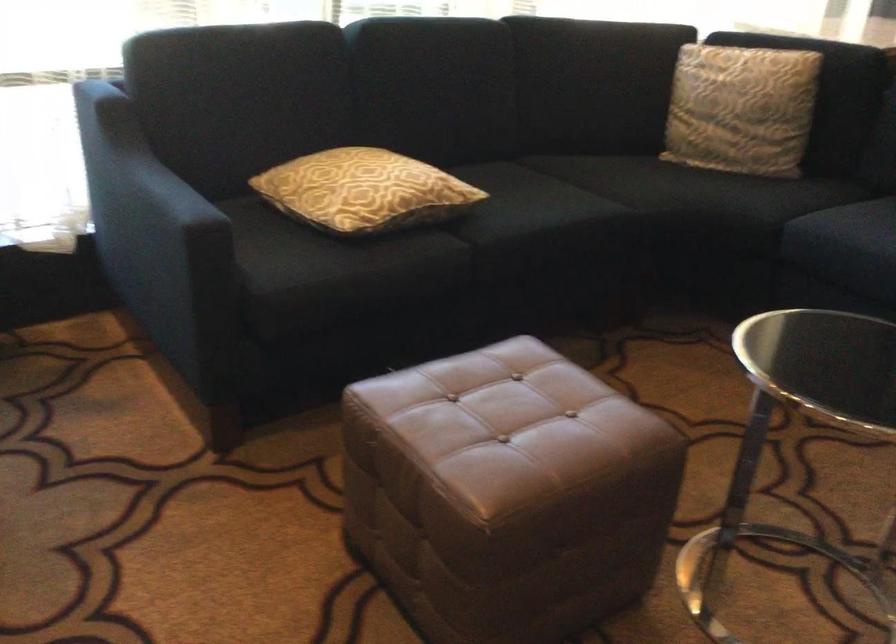
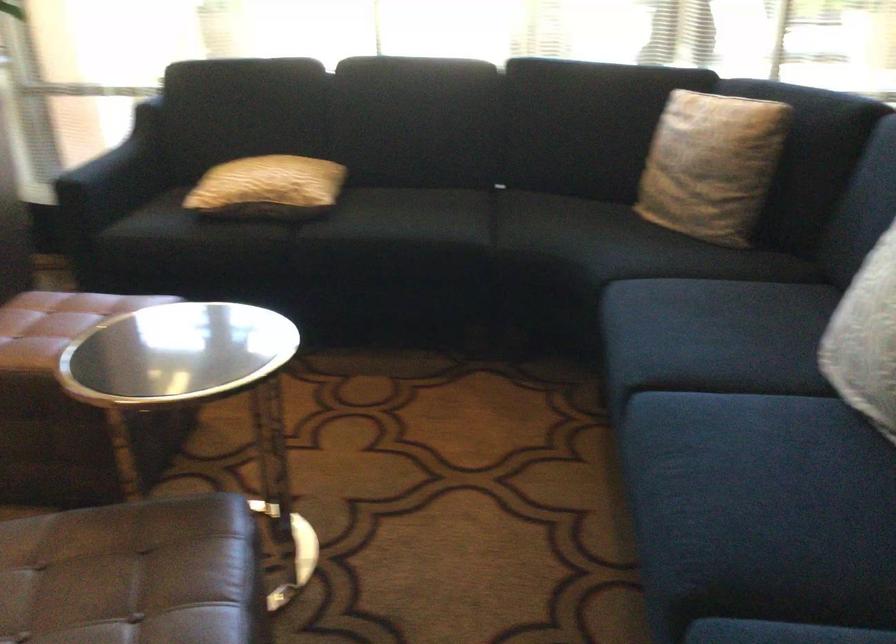
In the second image, find the point that corresponds to point 207,218 in the first image.

(115, 176)